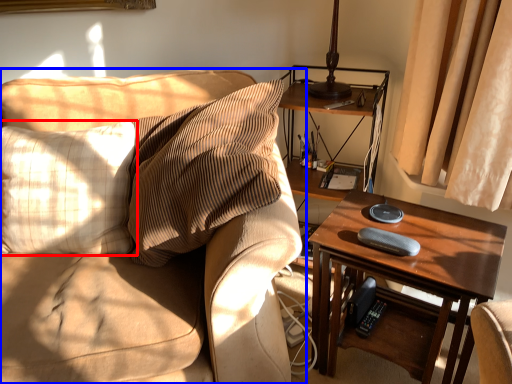
Question: Which of the following is the closest to the observer, pillow (highlighted by a red box) or studio couch (highlighted by a blue box)?

Choices:
 (A) pillow
 (B) studio couch

Answer: (B)